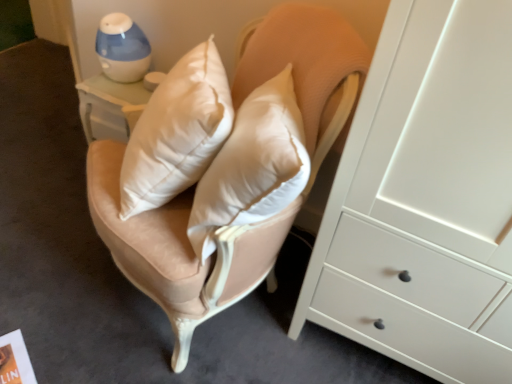
At what (x,y) coordinates should I click in order to perform the action: click on vacant space that is to the left of satin beige swivel chair at center. Please return your answer as a coordinate pair (x, y). This screenshot has width=512, height=384. Looking at the image, I should click on (48, 240).